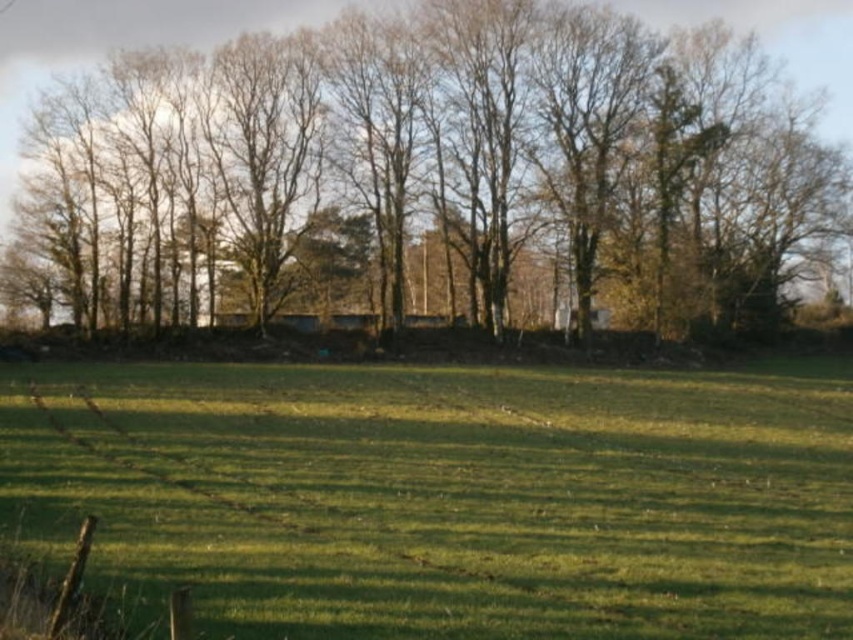
You are standing in the middle of the field and see the green grass at center and the brown leafless trees at upper center. Which object is positioned to the left when facing the trees?

The green grass at center is positioned to the left of the brown leafless trees at upper center.